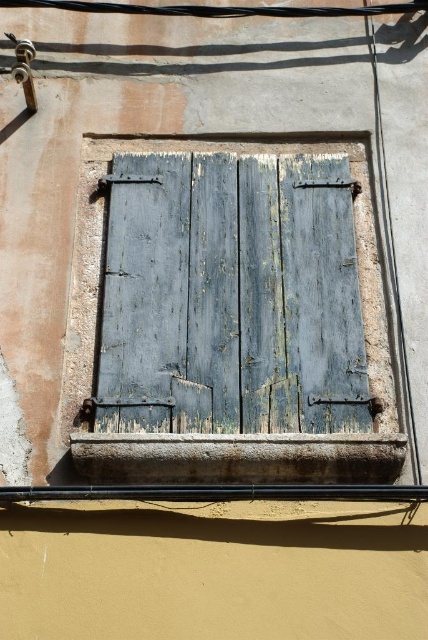
You are standing directly in front of the building shown in the image. Where would you look to see the weathered wood shutters at center?

The weathered wood shutters at center are located at the center of the image, so you should look straight ahead to see them.

You are a painter assessing the exterior wall of a building. You need to paint the weathered wood shutters at center and the rusty concrete window sill at lower center. Based on their positions, which object is closer to the left edge of the wall?

The weathered wood shutters at center is positioned on the left side of the rusty concrete window sill at lower center, so it is closer to the left edge of the wall.